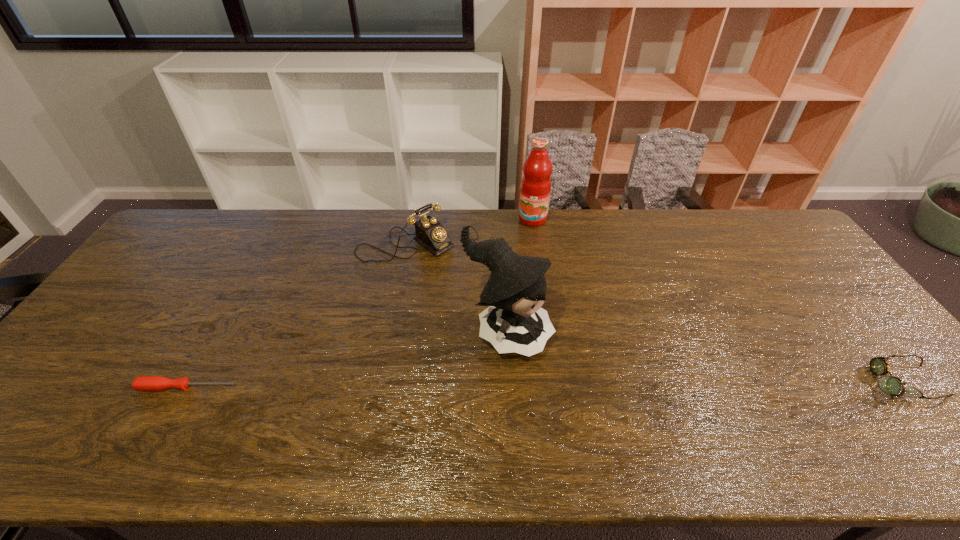
Locate an element on the screen. The width and height of the screenshot is (960, 540). unoccupied area between the rightmost object and the fourth nearest object is located at coordinates (652, 313).

Locate an element on the screen. This screenshot has width=960, height=540. free space between the fruit juice and the spectacles is located at coordinates (715, 300).

Find the location of `vacant area that lies between the fourth tallest object and the fruit juice`. vacant area that lies between the fourth tallest object and the fruit juice is located at coordinates (715, 300).

At what (x,y) coordinates should I click in order to perform the action: click on free space between the leftmost object and the doll. Please return your answer as a coordinate pair (x, y). Looking at the image, I should click on (348, 361).

Identify the location of free space between the rightmost object and the screwdriver. (542, 384).

Image resolution: width=960 pixels, height=540 pixels. I want to click on vacant area between the screwdriver and the second shortest object, so click(542, 384).

What are the coordinates of `unoccupied position between the fruit juice and the telephone` in the screenshot? It's located at (469, 232).

This screenshot has width=960, height=540. I want to click on unoccupied area between the rightmost object and the fruit juice, so click(x=715, y=300).

Identify the location of the fourth closest object to the third shortest object. (892, 385).

Locate which object ranks fourth in proximity to the shortest object. Please provide its 2D coordinates. Your answer should be formatted as a tuple, i.e. [(x, y)], where the tuple contains the x and y coordinates of a point satisfying the conditions above.

[(892, 385)]